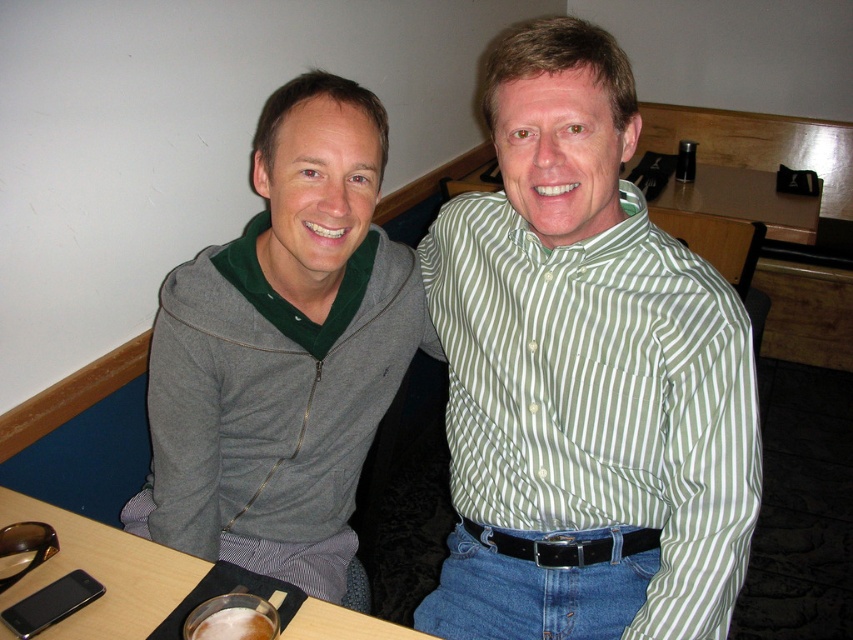
You are trying to place a new item on the table between the green striped shirt at center and the black plastic phone at lower left. Which object should you move to make space?

The green striped shirt at center is bigger than the black plastic phone at lower left, so you should move the black plastic phone at lower left to make space since it takes up less space.